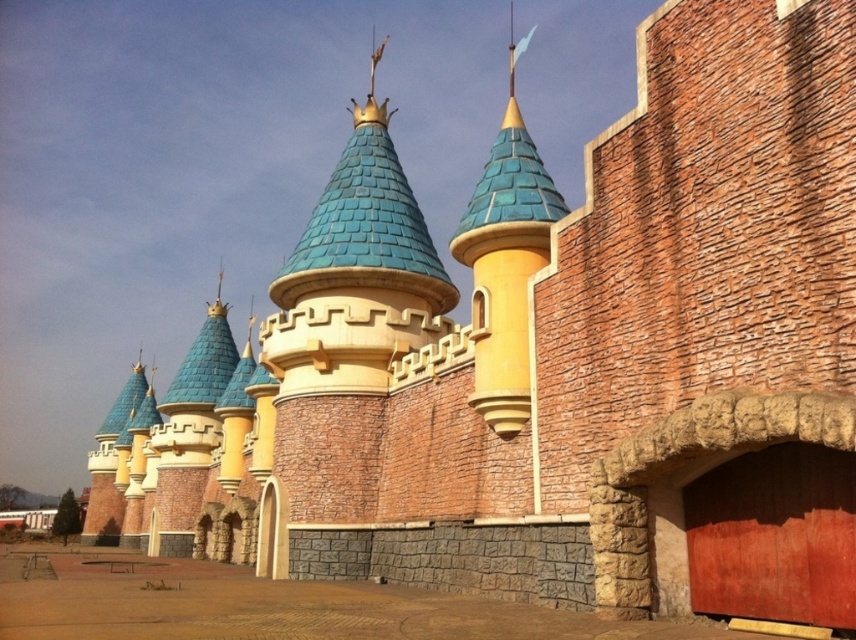
You are standing in front of the castle structure and need to locate both the red matte garage door at lower right and the matte blue tile tower at center. From your vantage point, which object is positioned to the left?

The red matte garage door at lower right is to the left of the matte blue tile tower at center.